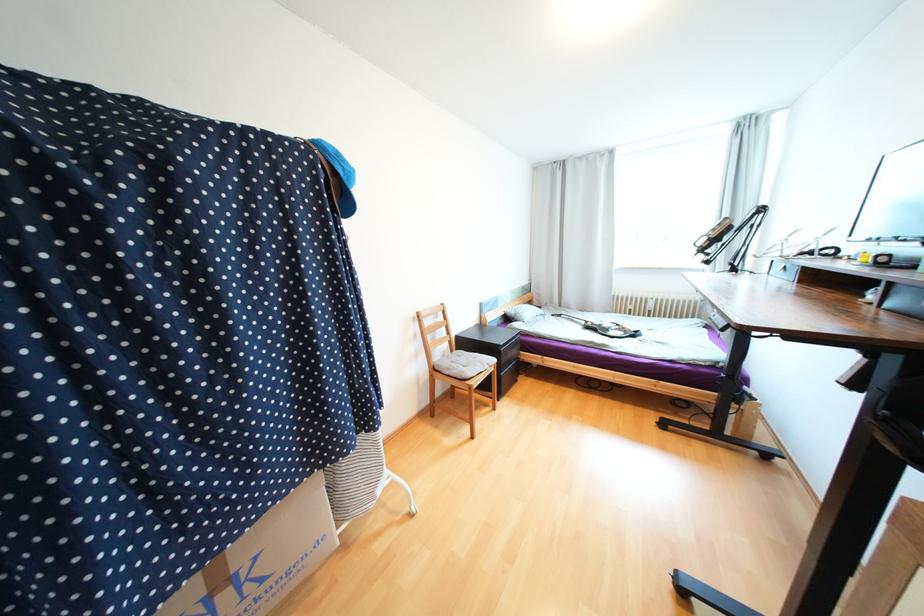
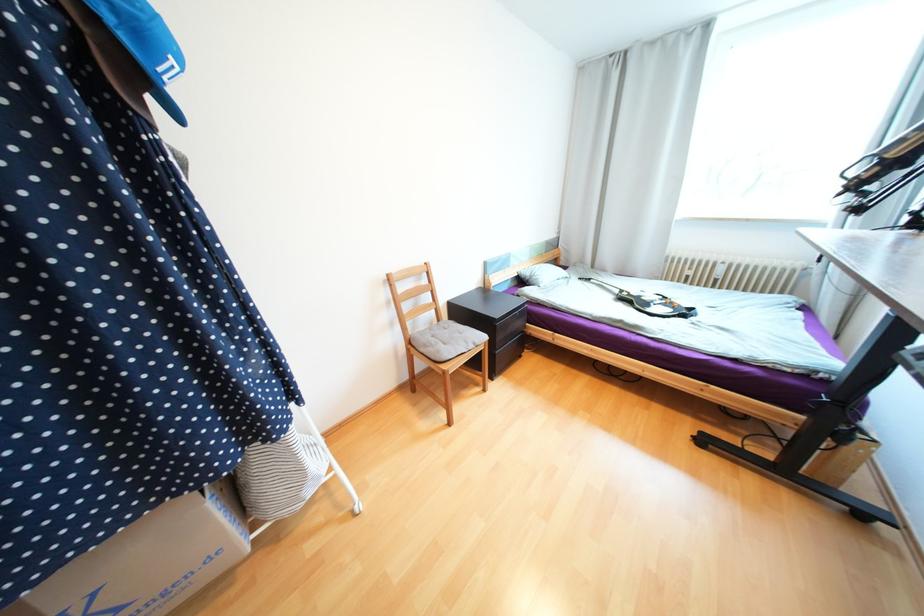
The point at (294,493) is marked in the first image. Where is the corresponding point in the second image?

(116, 535)